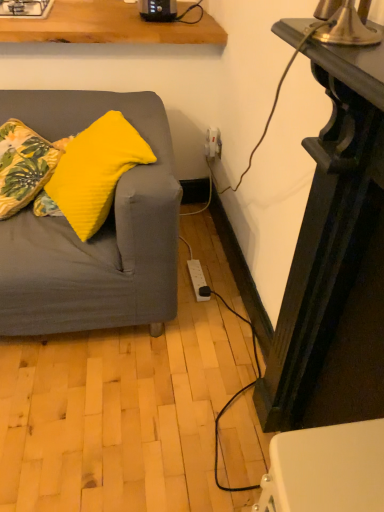
Question: From their relative heights in the image, would you say black plastic toaster at upper center is taller or shorter than white glossy gas stove at upper left?

Choices:
 (A) short
 (B) tall

Answer: (B)

Question: From the image's perspective, is black plastic toaster at upper center positioned above or below white glossy gas stove at upper left?

Choices:
 (A) below
 (B) above

Answer: (A)

Question: Which object is the closest to the black glossy table at right?

Choices:
 (A) white glossy gas stove at upper left
 (B) yellow fabric pillow at left, which appears as the 2th pillow when viewed from the left
 (C) black plastic toaster at upper center
 (D) yellow fabric pillow at left, marked as the 2th pillow in a right-to-left arrangement

Answer: (B)

Question: Estimate the real-world distances between objects in this image. Which object is farther from the yellow fabric pillow at left, which appears as the 2th pillow when viewed from the left?

Choices:
 (A) yellow fabric pillow at left, marked as the 2th pillow in a right-to-left arrangement
 (B) white glossy gas stove at upper left
 (C) black glossy table at right
 (D) black plastic toaster at upper center

Answer: (B)